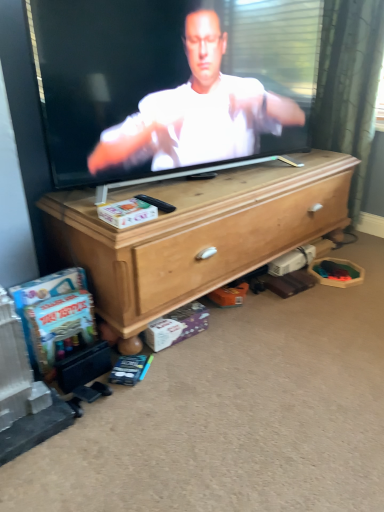
Question: From the image's perspective, is wooden chest of drawers at center located above black plastic remote control at center?

Choices:
 (A) yes
 (B) no

Answer: (B)

Question: Is wooden chest of drawers at center facing away from black plastic remote control at center?

Choices:
 (A) yes
 (B) no

Answer: (B)

Question: From the image's perspective, does wooden chest of drawers at center appear lower than black plastic remote control at center?

Choices:
 (A) no
 (B) yes

Answer: (B)

Question: Can you confirm if wooden chest of drawers at center is bigger than black plastic remote control at center?

Choices:
 (A) yes
 (B) no

Answer: (A)

Question: From a real-world perspective, is wooden chest of drawers at center located higher than black plastic remote control at center?

Choices:
 (A) no
 (B) yes

Answer: (A)

Question: Looking at the image, does black plastic remote control at center seem bigger or smaller compared to wooden chest of drawers at center?

Choices:
 (A) small
 (B) big

Answer: (A)

Question: In the image, is black plastic remote control at center positioned in front of or behind wooden chest of drawers at center?

Choices:
 (A) front
 (B) behind

Answer: (B)

Question: Is black plastic remote control at center spatially inside wooden chest of drawers at center, or outside of it?

Choices:
 (A) inside
 (B) outside

Answer: (B)

Question: Is black plastic remote control at center to the left or to the right of wooden chest of drawers at center in the image?

Choices:
 (A) left
 (B) right

Answer: (A)

Question: Is black plastic remote control at center spatially inside smooth white shirt at center, or outside of it?

Choices:
 (A) inside
 (B) outside

Answer: (B)

Question: From the image's perspective, is black plastic remote control at center above or below smooth white shirt at center?

Choices:
 (A) above
 (B) below

Answer: (B)

Question: From a real-world perspective, is black plastic remote control at center above or below smooth white shirt at center?

Choices:
 (A) above
 (B) below

Answer: (B)

Question: From their relative heights in the image, would you say black plastic remote control at center is taller or shorter than smooth white shirt at center?

Choices:
 (A) short
 (B) tall

Answer: (A)

Question: Would you say wooden chest of drawers at center is to the left or to the right of black plastic remote control at center in the picture?

Choices:
 (A) right
 (B) left

Answer: (A)

Question: Is wooden chest of drawers at center situated inside black plastic remote control at center or outside?

Choices:
 (A) inside
 (B) outside

Answer: (B)